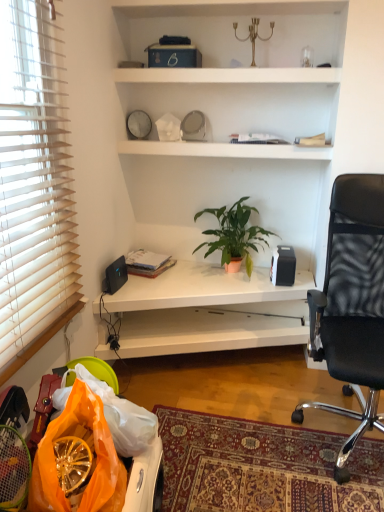
Where is `free space to the right of matte black book at left`? free space to the right of matte black book at left is located at coordinates (186, 272).